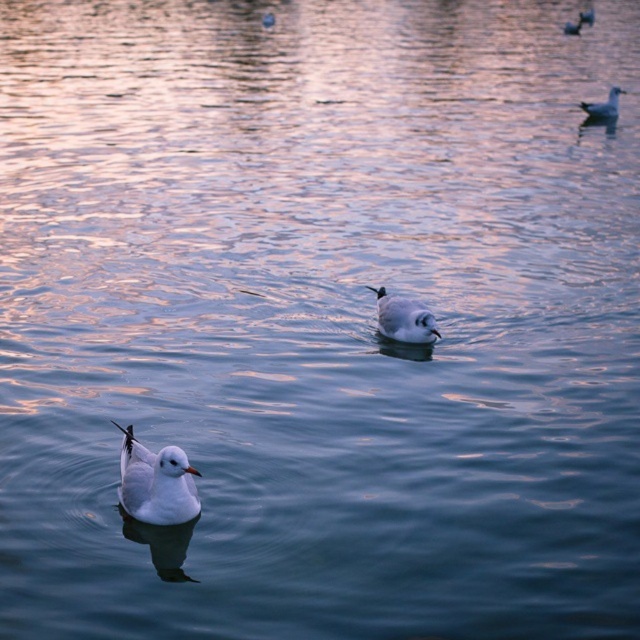
You are standing on the shore and see two seagulls on the water. The first seagull is at point (150, 506). The second seagull is at point 0.645, 0.321. If you want to throw a small piece of bread to the closer seagull, which coordinate should you aim for?

The seagull at point (150, 506) is closer to you, so you should aim for that coordinate.

You are an ornithologist observing the scene. You notice two white matte birds in the image. Which one has a smaller width between the white matte duck at lower left and the white matte bird at upper right?

The white matte duck at lower left has a lesser width compared to the white matte bird at upper right, so the white matte duck at lower left is smaller in width.

Based on the photo, you are standing on the shore observing the two white matte birds. Which bird is closer to you, the white matte bird at center or the white matte bird at upper right?

The white matte bird at center is closer to you because it is located below the white matte bird at upper right, indicating a lower position in the visual plane.